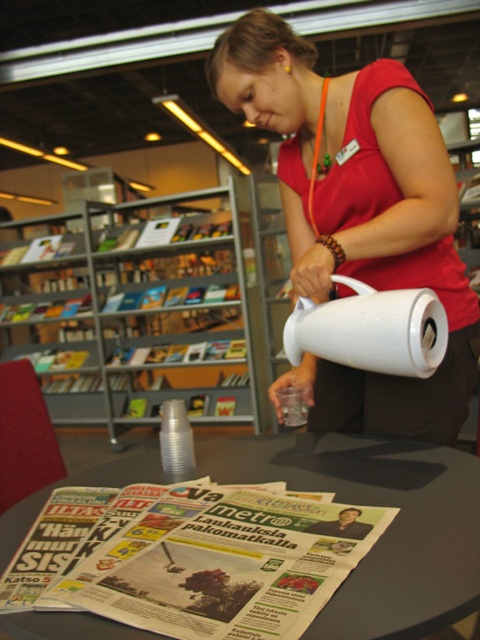
You are standing in front of the table at the bookstore. There are two points marked on the table. The first point is at coordinates point (126,324) and the second point is at point (40,634). Which point is closer to you?

Point (126,324) is further to the camera than point (40,634), so the point closer to you is point (40,634).

You are a customer at a bookstore and see a white glossy pitcher at center and a white matte jug at center on a table. Which one is located to the right side?

The white matte jug at center is located to the right of the white glossy pitcher at center.